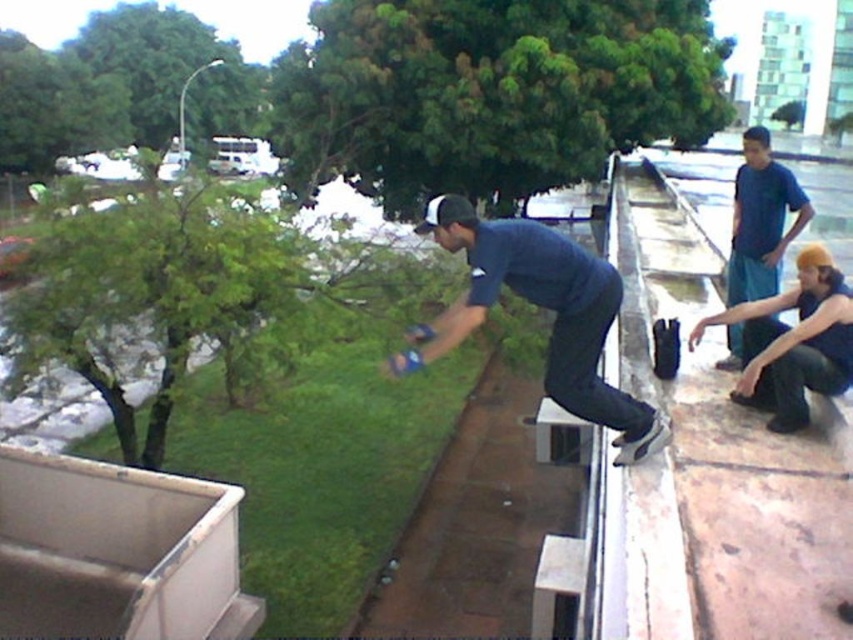
In the scene shown: Can you confirm if dark blue denim jeans at center is positioned to the left of blue cotton shirt at upper right?

Indeed, dark blue denim jeans at center is positioned on the left side of blue cotton shirt at upper right.

From the picture: Is dark blue denim jeans at center thinner than blue cotton shirt at upper right?

Yes, dark blue denim jeans at center is thinner than blue cotton shirt at upper right.

Locate an element on the screen. Image resolution: width=853 pixels, height=640 pixels. dark blue denim jeans at center is located at coordinates (540, 307).

Locate an element on the screen. Image resolution: width=853 pixels, height=640 pixels. dark blue denim jeans at center is located at coordinates (540, 307).

Is dark blue denim jeans at center positioned behind dark blue fabric squat at lower right?

That is False.

What do you see at coordinates (540, 307) in the screenshot? I see `dark blue denim jeans at center` at bounding box center [540, 307].

The height and width of the screenshot is (640, 853). In order to click on dark blue denim jeans at center in this screenshot , I will do `click(540, 307)`.

Between dark blue fabric squat at lower right and blue cotton shirt at upper right, which one is positioned lower?

dark blue fabric squat at lower right is below.

Which is in front, point (827, 307) or point (791, 204)?

Point (827, 307) is in front.

This screenshot has height=640, width=853. Identify the location of dark blue fabric squat at lower right. (792, 342).